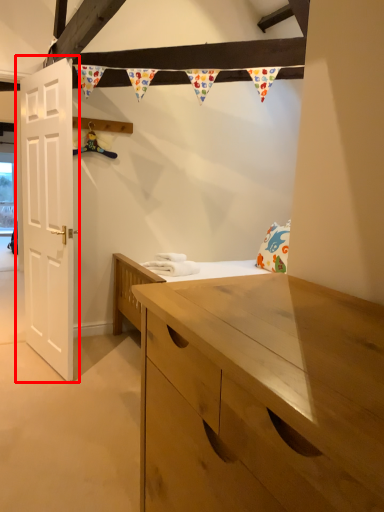
Question: Where is door (annotated by the red box) located in relation to laundry in the image?

Choices:
 (A) right
 (B) left

Answer: (B)